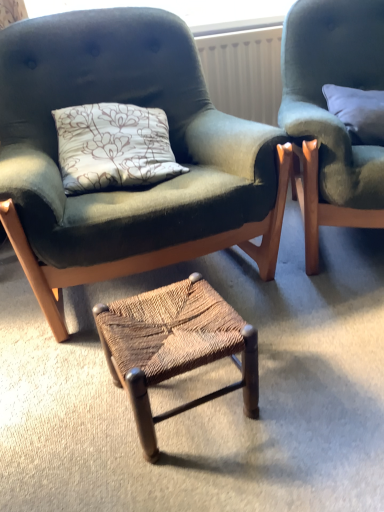
Question: In terms of height, does velvet green armchair at center, acting as the first chair starting from the left, look taller or shorter compared to white soft pillow at upper right?

Choices:
 (A) tall
 (B) short

Answer: (A)

Question: Is velvet green armchair at center, which is the 2th chair in right-to-left order, inside the boundaries of white soft pillow at upper right, or outside?

Choices:
 (A) inside
 (B) outside

Answer: (B)

Question: Considering the real-world distances, which object is closest to the white textured radiator at upper center?

Choices:
 (A) velvet green armchair at center, acting as the first chair starting from the left
 (B) white soft pillow at upper right
 (C) velvet green chair at upper right, which ranks as the second chair in left-to-right order
 (D) woven wood stool at center

Answer: (B)

Question: Which is nearer to the velvet green armchair at center, which is the 2th chair in right-to-left order?

Choices:
 (A) white soft pillow at upper right
 (B) white textured radiator at upper center
 (C) woven wood stool at center
 (D) velvet green chair at upper right, which is the first chair in right-to-left order

Answer: (C)